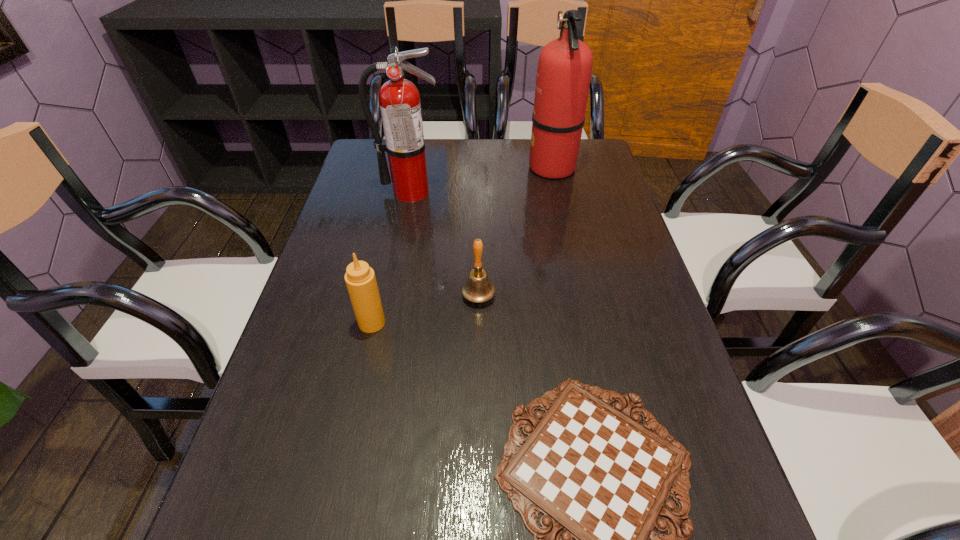
Identify the location of free location located on the left of the bell. (337, 296).

Locate an element on the screen. The image size is (960, 540). object present at the far edge is located at coordinates (564, 70).

Find the location of a particular element. fire extinguisher that is at the left edge is located at coordinates (399, 99).

Where is `condiment that is at the left edge`? The width and height of the screenshot is (960, 540). condiment that is at the left edge is located at coordinates (360, 279).

What are the coordinates of `object located in the right edge section of the desktop` in the screenshot? It's located at (564, 70).

Locate an element on the screen. The width and height of the screenshot is (960, 540). object located at the far right corner is located at coordinates (564, 70).

In the image, there is a desktop. At what (x,y) coordinates should I click in order to perform the action: click on vacant space at the far edge. Please return your answer as a coordinate pair (x, y). Looking at the image, I should click on (522, 141).

Find the location of `blank space at the left edge of the desktop`. blank space at the left edge of the desktop is located at coordinates pyautogui.click(x=367, y=229).

In the image, there is a desktop. Find the location of `vacant space at the right edge`. vacant space at the right edge is located at coordinates (616, 208).

Identify the location of vacant space at the far left corner of the desktop. (372, 144).